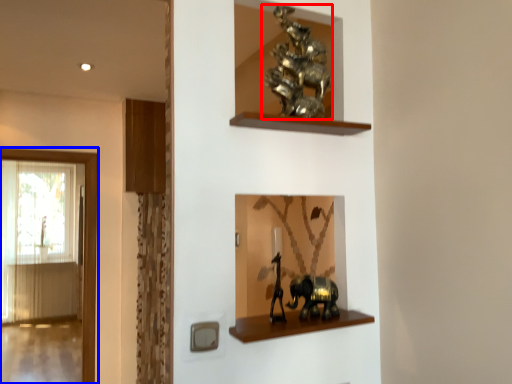
Question: Which point is further to the camera, animal (highlighted by a red box) or window (highlighted by a blue box)?

Choices:
 (A) animal
 (B) window

Answer: (B)